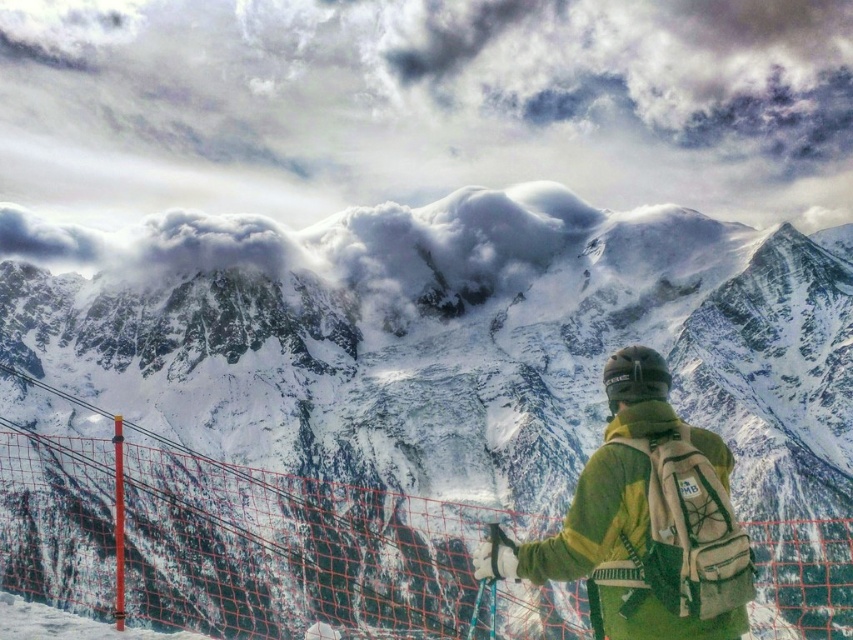
Question: Which of these objects is positioned closest to the red mesh fence at center?

Choices:
 (A) snowy mountain at center
 (B) green fleece jacket at lower right

Answer: (A)

Question: Is snowy mountain at center below green fleece jacket at lower right?

Choices:
 (A) no
 (B) yes

Answer: (A)

Question: Can you confirm if snowy mountain at center is positioned below red mesh fence at center?

Choices:
 (A) yes
 (B) no

Answer: (B)

Question: Among these points, which one is nearest to the camera?

Choices:
 (A) (577, 522)
 (B) (795, 324)
 (C) (19, 531)

Answer: (A)

Question: Is snowy mountain at center bigger than red mesh fence at center?

Choices:
 (A) yes
 (B) no

Answer: (A)

Question: Which of the following is the closest to the observer?

Choices:
 (A) snowy mountain at center
 (B) red mesh fence at center
 (C) green fleece jacket at lower right

Answer: (C)